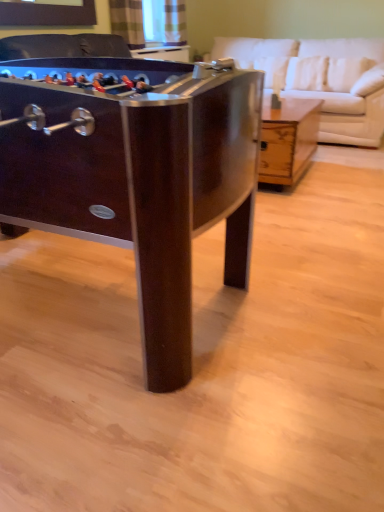
The image size is (384, 512). What do you see at coordinates (287, 139) in the screenshot? I see `wooden coffee table at center, marked as the second table in a front-to-back arrangement` at bounding box center [287, 139].

The image size is (384, 512). In order to click on dark wood foosball table at left, which ranks as the 2th table in back-to-front order in this screenshot , I will do click(137, 175).

Can you confirm if wooden coffee table at center, which is counted as the 1th table, starting from the back, is positioned to the left of white leather couch at upper right?

Yes.

Does point (269, 178) appear closer or farther from the camera than point (369, 53)?

Point (269, 178) appears to be closer to the viewer than point (369, 53).

Is wooden coffee table at center, which is counted as the 1th table, starting from the back, smaller than white leather couch at upper right?

Yes, wooden coffee table at center, which is counted as the 1th table, starting from the back, is smaller than white leather couch at upper right.

Does wooden coffee table at center, the 2th table viewed from the left, contain white leather couch at upper right?

No, white leather couch at upper right is not inside wooden coffee table at center, the 2th table viewed from the left.

Which point is more forward, (84, 63) or (378, 139)?

Point (84, 63)

Does dark wood foosball table at left, which ranks as the 2th table in back-to-front order, have a lesser height compared to white leather couch at upper right?

Correct, dark wood foosball table at left, which ranks as the 2th table in back-to-front order, is not as tall as white leather couch at upper right.

Which object is wider, dark wood foosball table at left, positioned as the 2th table in right-to-left order, or white leather couch at upper right?

With larger width is dark wood foosball table at left, positioned as the 2th table in right-to-left order.

Choose the correct answer: Is white leather couch at upper right inside wooden coffee table at center, which is counted as the 1th table, starting from the back, or outside it?

white leather couch at upper right is located beyond the bounds of wooden coffee table at center, which is counted as the 1th table, starting from the back.

Is point (358, 143) positioned behind point (302, 101)?

Yes.

From the image's perspective, is white leather couch at upper right positioned above or below wooden coffee table at center, the 2th table viewed from the left?

From the image's perspective, white leather couch at upper right appears above wooden coffee table at center, the 2th table viewed from the left.

Is white leather couch at upper right at the right side of dark wood foosball table at left, which is the first table in left-to-right order?

Correct, you'll find white leather couch at upper right to the right of dark wood foosball table at left, which is the first table in left-to-right order.

Is white leather couch at upper right in front of or behind dark wood foosball table at left, positioned as the 2th table in right-to-left order, in the image?

white leather couch at upper right is behind dark wood foosball table at left, positioned as the 2th table in right-to-left order.

Does point (346, 110) come farther from viewer compared to point (69, 227)?

Yes, it is.

From a real-world perspective, is white leather couch at upper right physically located above or below dark wood foosball table at left, which ranks as the 2th table in back-to-front order?

white leather couch at upper right is above dark wood foosball table at left, which ranks as the 2th table in back-to-front order.

From a real-world perspective, is wooden coffee table at center, the 2th table viewed from the left, beneath dark wood foosball table at left, positioned as the 2th table in right-to-left order?

Correct, in the physical world, wooden coffee table at center, the 2th table viewed from the left, is lower than dark wood foosball table at left, positioned as the 2th table in right-to-left order.

Is wooden coffee table at center, the 2th table viewed from the left, outside of dark wood foosball table at left, positioned as the 2th table in right-to-left order?

Yes.

Locate an element on the screen. Image resolution: width=384 pixels, height=512 pixels. table that appears below the dark wood foosball table at left, the 1th table positioned from the front (from a real-world perspective) is located at coordinates (287, 139).

How different are the orientations of wooden coffee table at center, which is counted as the 1th table, starting from the back, and dark wood foosball table at left, which ranks as the 2th table in back-to-front order, in degrees?

The angle between the facing direction of wooden coffee table at center, which is counted as the 1th table, starting from the back, and the facing direction of dark wood foosball table at left, which ranks as the 2th table in back-to-front order, is 89 degrees.

Could you tell me if dark wood foosball table at left, the 1th table positioned from the front, is turned towards wooden coffee table at center, the 2th table viewed from the left?

Yes, dark wood foosball table at left, the 1th table positioned from the front, is aimed at wooden coffee table at center, the 2th table viewed from the left.

Which is nearer, (103,113) or (280,157)?

Point (103,113) appears to be closer to the viewer than point (280,157).

Which of these two, dark wood foosball table at left, which ranks as the 2th table in back-to-front order, or wooden coffee table at center, marked as the second table in a front-to-back arrangement, is smaller?

With smaller size is wooden coffee table at center, marked as the second table in a front-to-back arrangement.

Is dark wood foosball table at left, which is the first table in left-to-right order, further to the viewer compared to wooden coffee table at center, marked as the second table in a front-to-back arrangement?

No, it is not.

Where is `studio couch above the wooden coffee table at center, marked as the second table in a front-to-back arrangement (from the image's perspective)`? The width and height of the screenshot is (384, 512). studio couch above the wooden coffee table at center, marked as the second table in a front-to-back arrangement (from the image's perspective) is located at coordinates (326, 80).

From the image's perspective, starting from the white leather couch at upper right, which table is the 2nd one below? Please provide its 2D coordinates.

[(137, 175)]

When comparing their distances from white leather couch at upper right, does wooden coffee table at center, the 2th table viewed from the left, or dark wood foosball table at left, which is the first table in left-to-right order, seem closer?

wooden coffee table at center, the 2th table viewed from the left, is positioned closer to the anchor white leather couch at upper right.

Which object lies nearer to the anchor point white leather couch at upper right, dark wood foosball table at left, which is the first table in left-to-right order, or wooden coffee table at center, marked as the second table in a front-to-back arrangement?

Based on the image, wooden coffee table at center, marked as the second table in a front-to-back arrangement, appears to be nearer to white leather couch at upper right.

Considering their positions, is wooden coffee table at center, the 2th table viewed from the left, positioned further to dark wood foosball table at left, positioned as the 2th table in right-to-left order, than white leather couch at upper right?

The object further to dark wood foosball table at left, positioned as the 2th table in right-to-left order, is white leather couch at upper right.

Considering their positions, is white leather couch at upper right positioned closer to dark wood foosball table at left, which ranks as the 2th table in back-to-front order, than wooden coffee table at center, marked as the second table in a front-to-back arrangement?

wooden coffee table at center, marked as the second table in a front-to-back arrangement, lies closer to dark wood foosball table at left, which ranks as the 2th table in back-to-front order, than the other object.

From the image, which object appears to be farther from wooden coffee table at center, which is counted as the 1th table, starting from the back, dark wood foosball table at left, positioned as the 2th table in right-to-left order, or white leather couch at upper right?

dark wood foosball table at left, positioned as the 2th table in right-to-left order, is positioned further to the anchor wooden coffee table at center, which is counted as the 1th table, starting from the back.

When comparing their distances from wooden coffee table at center, the 1th table viewed from the right, does white leather couch at upper right or dark wood foosball table at left, which is the first table in left-to-right order, seem further?

Among the two, dark wood foosball table at left, which is the first table in left-to-right order, is located further to wooden coffee table at center, the 1th table viewed from the right.

Locate an element on the screen. table between dark wood foosball table at left, which is the first table in left-to-right order, and white leather couch at upper right, along the z-axis is located at coordinates (287, 139).